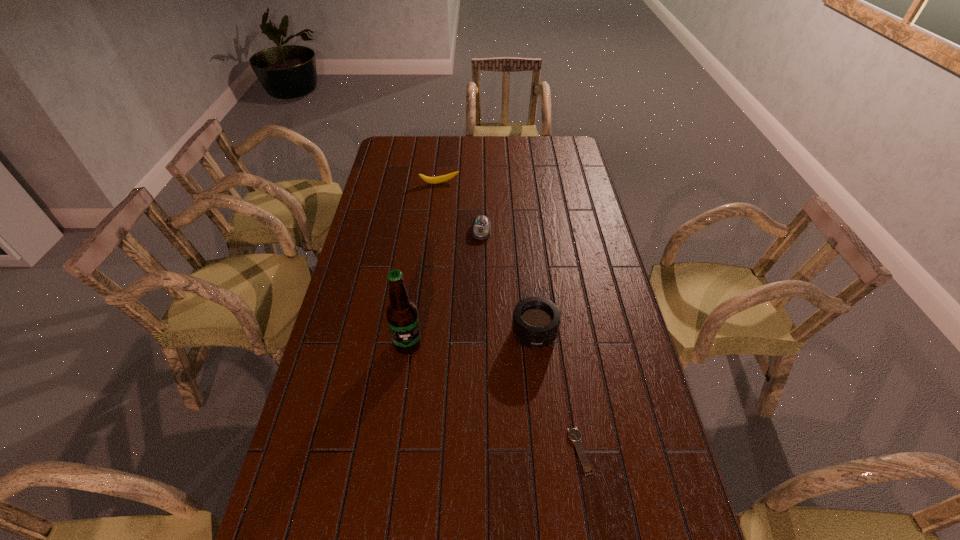
At what (x,y) coordinates should I click in order to perform the action: click on vacant position at the near edge of the desktop. Please return your answer as a coordinate pair (x, y). This screenshot has height=540, width=960. Looking at the image, I should click on (597, 501).

The width and height of the screenshot is (960, 540). I want to click on free point at the left edge, so point(365,340).

Image resolution: width=960 pixels, height=540 pixels. I want to click on vacant space at the right edge, so click(x=571, y=204).

Where is `vacant space at the far left corner of the desktop`? vacant space at the far left corner of the desktop is located at coordinates (409, 154).

In the image, there is a desktop. Identify the location of vacant space at the near right corner. (645, 517).

In order to click on vacant space that is in between the beer bottle and the farthest object in this screenshot , I will do `click(423, 264)`.

Image resolution: width=960 pixels, height=540 pixels. I want to click on empty location between the fourth nearest object and the tallest object, so click(444, 287).

This screenshot has height=540, width=960. Find the location of `free area in between the nearest object and the farthest object`. free area in between the nearest object and the farthest object is located at coordinates (510, 317).

The width and height of the screenshot is (960, 540). I want to click on vacant area that lies between the computer mouse and the telephoto lens, so click(x=508, y=282).

Where is `free space between the beer bottle and the farthest object`? The image size is (960, 540). free space between the beer bottle and the farthest object is located at coordinates (423, 264).